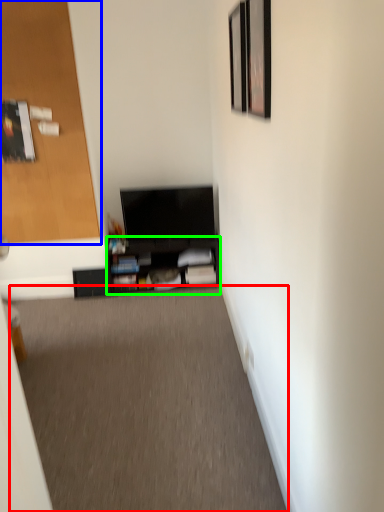
Question: Which is farther away from plain (highlighted by a red box)? door (highlighted by a blue box) or shelf (highlighted by a green box)?

Choices:
 (A) door
 (B) shelf

Answer: (A)